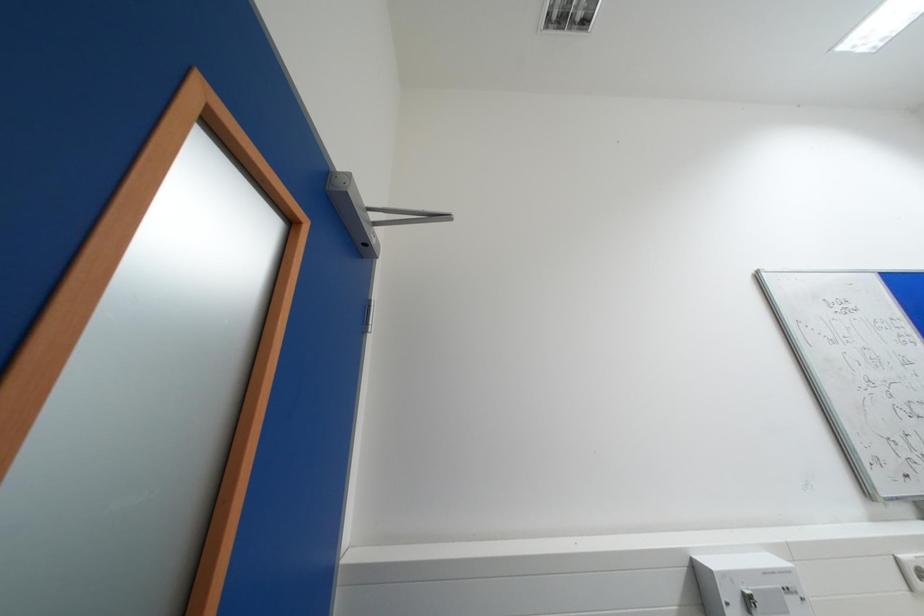
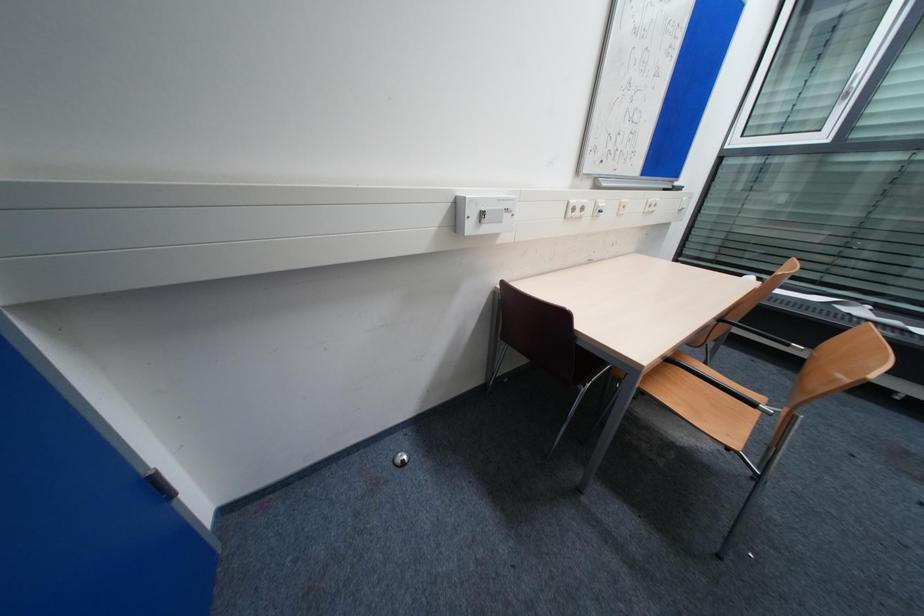
The first image is from the beginning of the video and the second image is from the end. How did the camera likely rotate when shooting the video?

The camera's rotation is toward right-down.